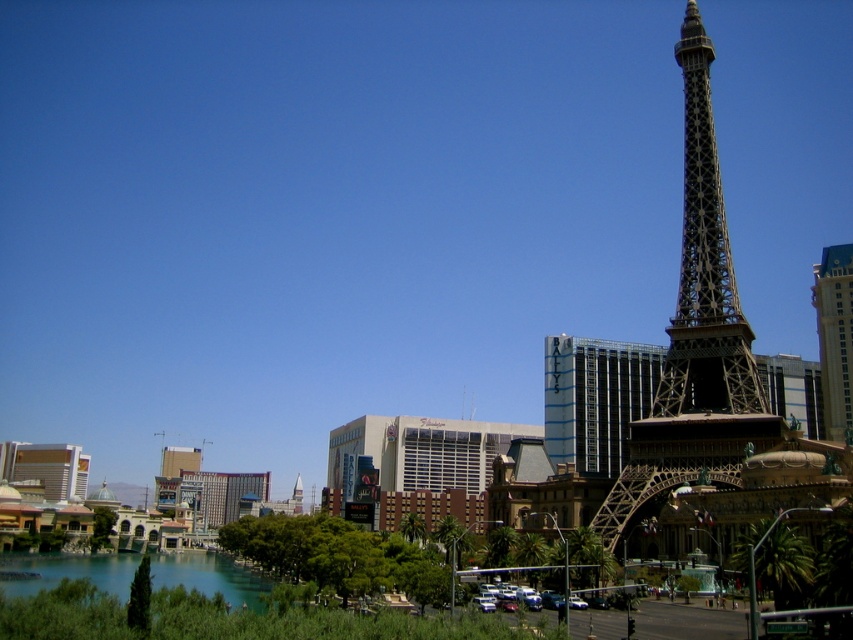
You are a tour guide leading a group to the metallic silver hotel at center. The group is currently standing at the base of the metallic brown eiffel tower at center. Can you tell them if they can walk directly to the hotel without any obstacles?

The distance between the metallic brown eiffel tower at center and the metallic silver hotel at center is 48.67 meters. Since there are no mentioned obstacles in the scene description, the group can walk directly to the hotel.

You are a tourist standing in front of the Paris Las Vegas hotel. You notice two nearby hotels in the scene. Which one is bigger between the metallic silver hotel at center and the gold metallic hotel at right?

The metallic silver hotel at center is larger in size than the gold metallic hotel at right.

You are standing in front of the Eiffel Tower replica at the Paris Las Vegas hotel. You notice two hotels in the background, the metallic silver hotel at center and the gold metallic hotel at right. Which hotel would appear larger to you?

The metallic silver hotel at center appears larger because it is closer to the viewer than the gold metallic hotel at right.